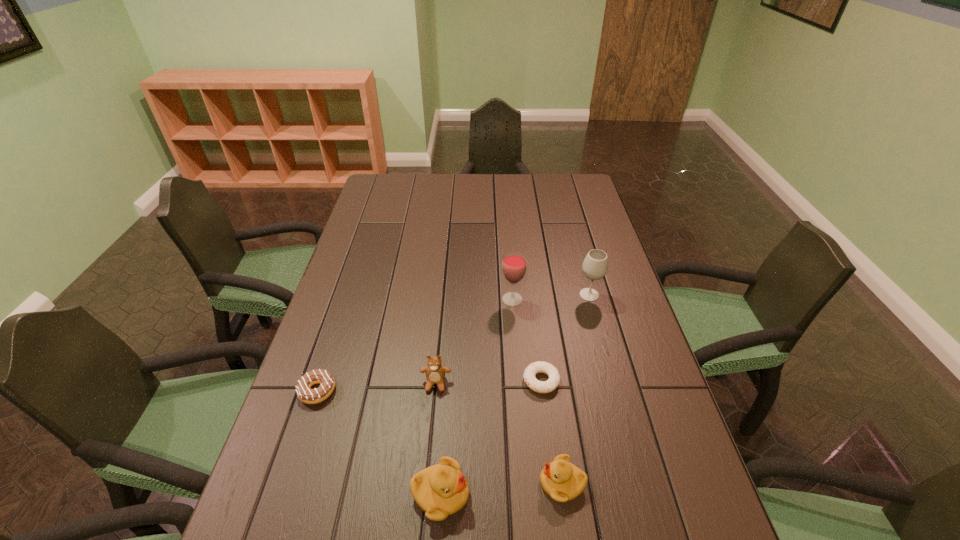
Locate an element on the screen. This screenshot has height=540, width=960. vacant region located 0.110m on the front-facing side of the left duckling is located at coordinates (523, 495).

Where is `blank area located 0.390m on the front-facing side of the right duckling`? blank area located 0.390m on the front-facing side of the right duckling is located at coordinates (354, 483).

The height and width of the screenshot is (540, 960). Find the location of `free space located 0.230m on the front-facing side of the right duckling`. free space located 0.230m on the front-facing side of the right duckling is located at coordinates (430, 483).

Find the location of a particular element. vacant space located on the front-facing side of the right duckling is located at coordinates (425, 483).

Where is `vacant area located 0.290m on the left of the left wineglass`? vacant area located 0.290m on the left of the left wineglass is located at coordinates (405, 300).

At what (x,y) coordinates should I click in order to perform the action: click on vacant space located on the right of the taller doughnut. Please return your answer as a coordinate pair (x, y). This screenshot has height=540, width=960. Looking at the image, I should click on (448, 391).

This screenshot has height=540, width=960. In order to click on vacant region located on the left of the right wineglass in this screenshot , I will do `click(474, 295)`.

Locate an element on the screen. This screenshot has height=540, width=960. vacant region located on the front-facing side of the teddy bear is located at coordinates (426, 492).

Image resolution: width=960 pixels, height=540 pixels. In order to click on free space located 0.240m on the back of the right doughnut in this screenshot , I will do `click(532, 302)`.

The height and width of the screenshot is (540, 960). Identify the location of object situated at the left edge. (323, 377).